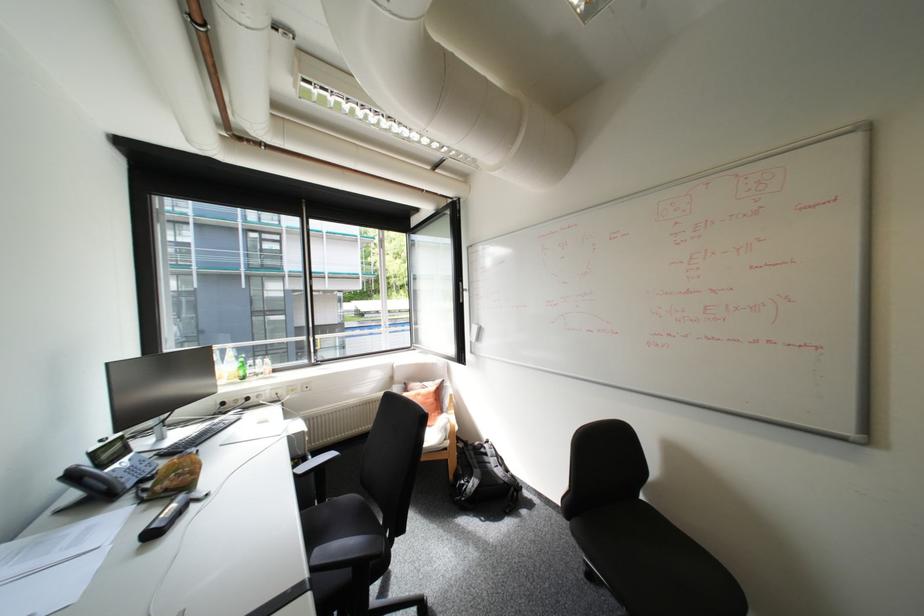
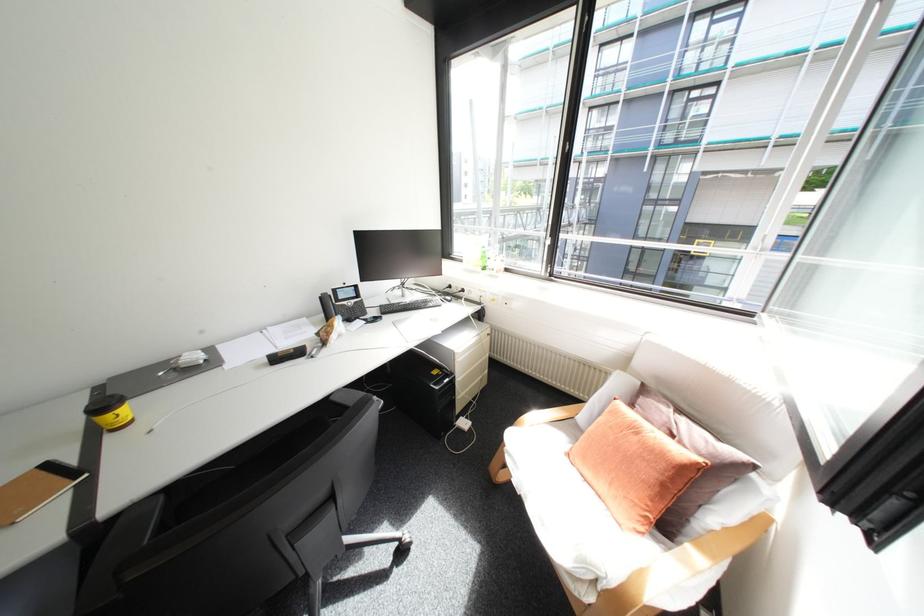
Where in the second image is the point corresponding to the point at 428,384 from the first image?

(677, 410)